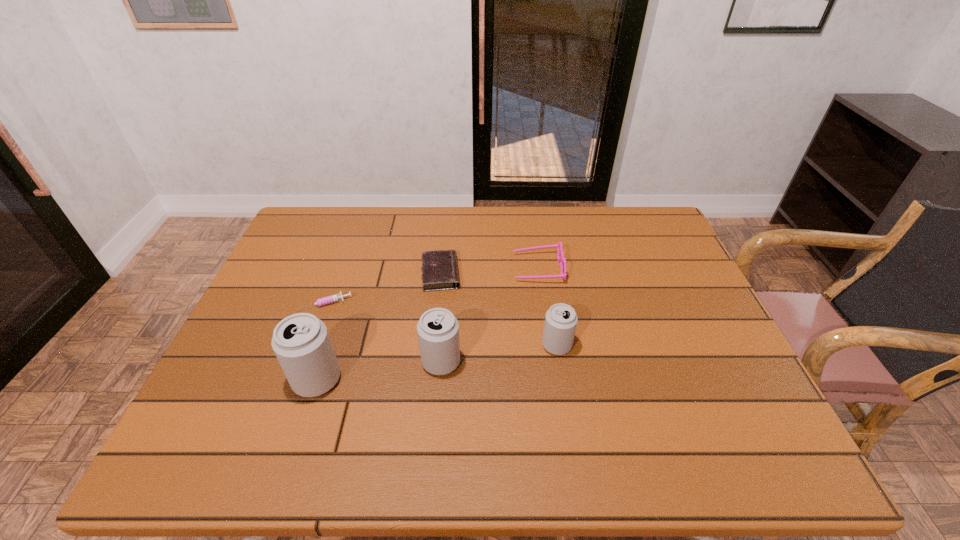
The width and height of the screenshot is (960, 540). In the image, there is a desktop. Identify the location of vacant area at the far edge. (478, 219).

Image resolution: width=960 pixels, height=540 pixels. I want to click on vacant space at the near edge of the desktop, so click(631, 402).

The height and width of the screenshot is (540, 960). Find the location of `vacant space at the left edge of the desktop`. vacant space at the left edge of the desktop is located at coordinates (259, 366).

Identify the location of free space at the right edge of the desktop. (684, 279).

Where is `vacant space at the far right corner of the desktop`? The image size is (960, 540). vacant space at the far right corner of the desktop is located at coordinates (664, 240).

At what (x,y) coordinates should I click in order to perform the action: click on free space between the diary and the shortest object. Please return your answer as a coordinate pair (x, y). Image resolution: width=960 pixels, height=540 pixels. Looking at the image, I should click on click(383, 288).

The width and height of the screenshot is (960, 540). What are the coordinates of `free area in between the fourth nearest object and the diary` in the screenshot? It's located at (383, 288).

The width and height of the screenshot is (960, 540). Identify the location of vacant area that lies between the fifth tallest object and the third farthest object. (383, 288).

Identify the location of unoccupied area between the rightmost can and the spectacles. (547, 307).

The width and height of the screenshot is (960, 540). What are the coordinates of `free spot between the syringe and the diary` in the screenshot? It's located at (383, 288).